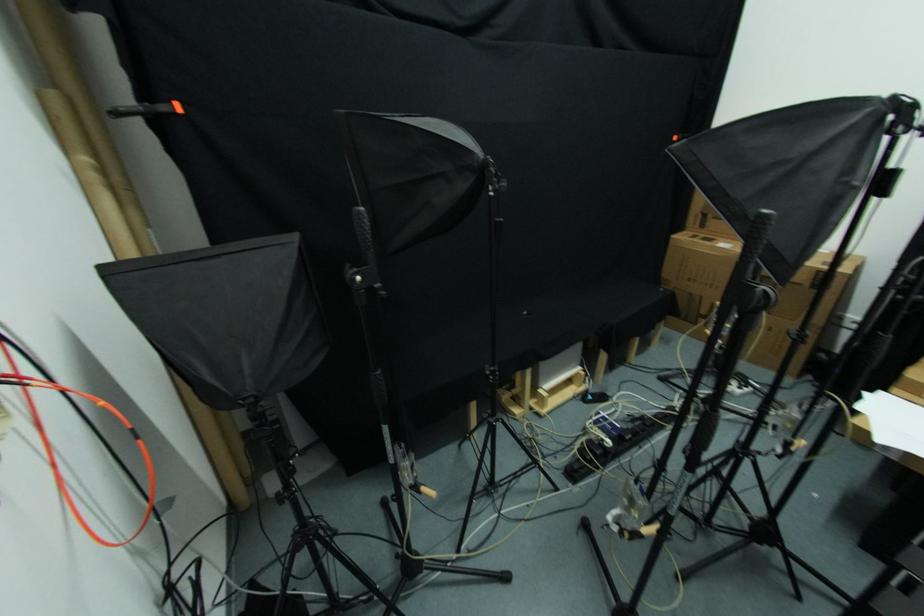
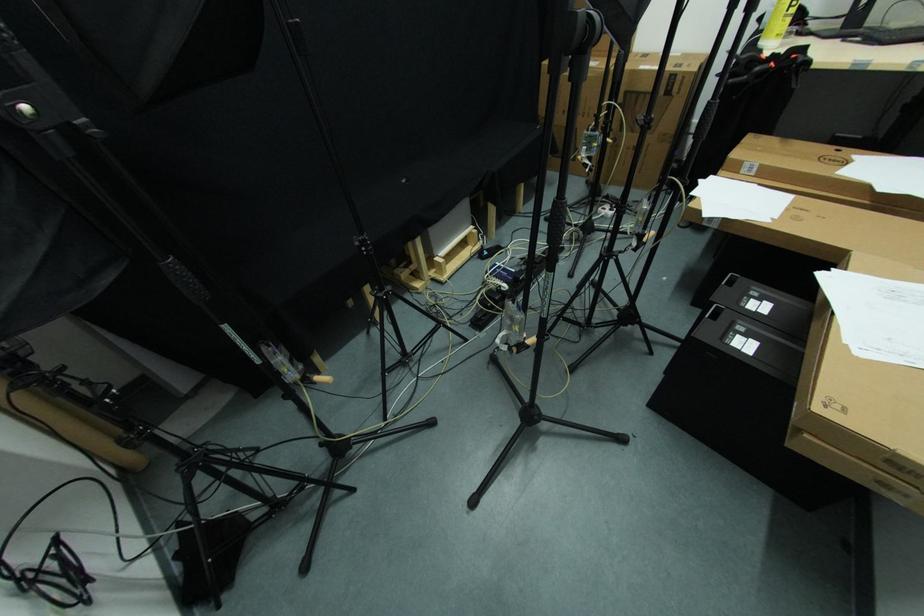
Which direction would the cameraman need to move to produce the second image?

The cameraman moved toward right, forward.